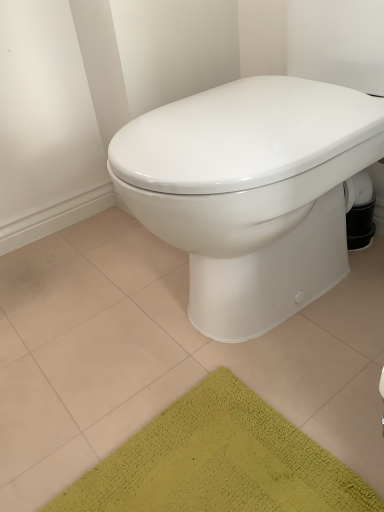
Locate an element on the screen. The height and width of the screenshot is (512, 384). white glossy toilet at center is located at coordinates (250, 192).

What is the approximate width of white glossy toilet at center?

55.60 centimeters.

This screenshot has height=512, width=384. Describe the element at coordinates (250, 192) in the screenshot. I see `white glossy toilet at center` at that location.

Find the location of a particular element. Image resolution: width=384 pixels, height=512 pixels. white glossy toilet at center is located at coordinates (250, 192).